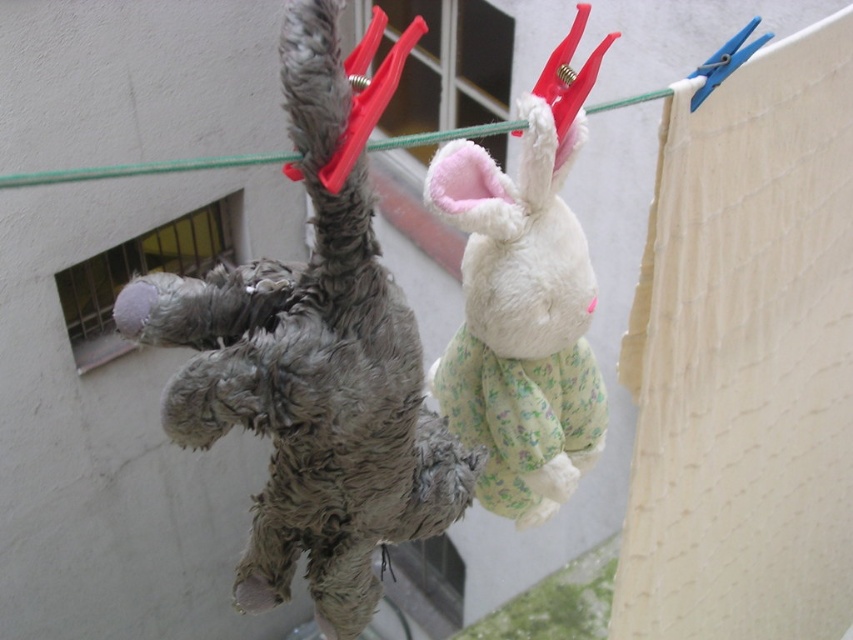
You are a child who wants to hang a new 10 inch long stuffed bear between the fuzzy gray stuffed animal at left and the white plush rabbit at center. Is there enough space between them to fit the new stuffed bear?

The distance between the fuzzy gray stuffed animal at left and the white plush rabbit at center is 9.75 inches. Since the new stuffed bear is 10 inches long, there is not enough space to fit it between them.

Based on the photo, you are a child trying to reach the fuzzy gray stuffed animal at left and the white plush rabbit at center hanging from the clothesline. If you can only reach up to 1.5 meters, which toy can you reach?

The fuzzy gray stuffed animal at left is taller than the white plush rabbit at center. Since the fuzzy gray stuffed animal at left is higher up, it might be out of your reach if it is above 1.5 meters. However, the white plush rabbit at center is shorter and may be within your reach if it is below 1.5 meters. Without exact heights, it is hard to say for sure.